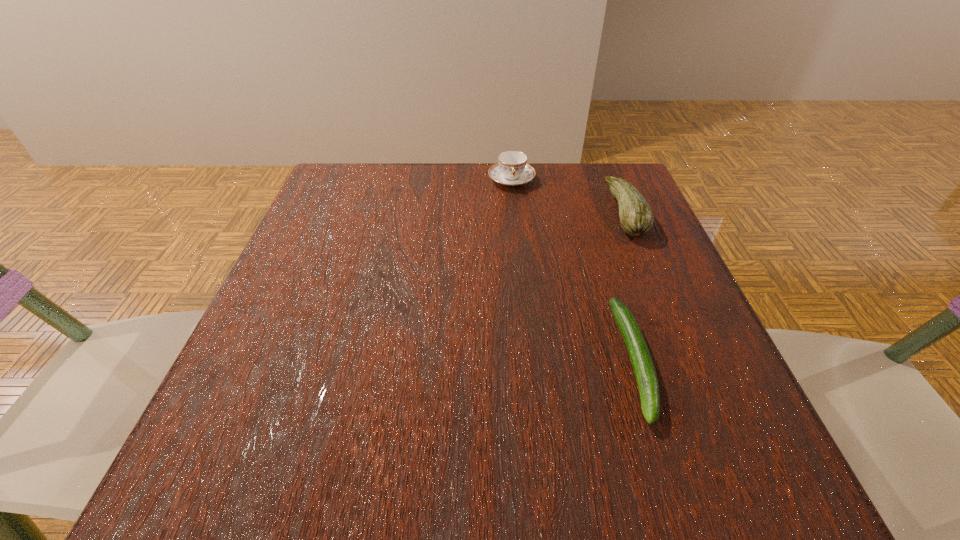
At what (x,y) coordinates should I click in order to perform the action: click on zucchini positioned at the far edge. Please return your answer as a coordinate pair (x, y). This screenshot has width=960, height=540. Looking at the image, I should click on (636, 217).

This screenshot has width=960, height=540. What are the coordinates of `teacup situated at the far edge` in the screenshot? It's located at (512, 169).

Identify the location of object located at the far right corner. The width and height of the screenshot is (960, 540). (636, 217).

You are a GUI agent. You are given a task and a screenshot of the screen. Output one action in this format:
    pyautogui.click(x=<x>, y=<y>)
    Task: Click on the free space at the far edge of the desktop
    Image resolution: width=960 pixels, height=540 pixels.
    Given the screenshot: What is the action you would take?
    pyautogui.click(x=557, y=187)

You are a GUI agent. You are given a task and a screenshot of the screen. Output one action in this format:
    pyautogui.click(x=<x>, y=<y>)
    Task: Click on the vacant space at the near edge of the desktop
    
    Given the screenshot: What is the action you would take?
    pyautogui.click(x=409, y=437)

Locate an element on the screen. This screenshot has height=540, width=960. vacant space at the left edge is located at coordinates (304, 258).

Identify the location of free spot at the right edge of the desktop. (644, 282).

This screenshot has height=540, width=960. Find the location of `vacant space at the far left corner of the desktop`. vacant space at the far left corner of the desktop is located at coordinates (373, 195).

You are a GUI agent. You are given a task and a screenshot of the screen. Output one action in this format:
    pyautogui.click(x=<x>, y=<y>)
    Task: Click on the vacant space at the far right corner of the desktop
    This screenshot has width=960, height=540.
    Given the screenshot: What is the action you would take?
    pyautogui.click(x=596, y=183)

Image resolution: width=960 pixels, height=540 pixels. What are the coordinates of `free spot at the near right corner of the desktop` in the screenshot? It's located at (715, 442).